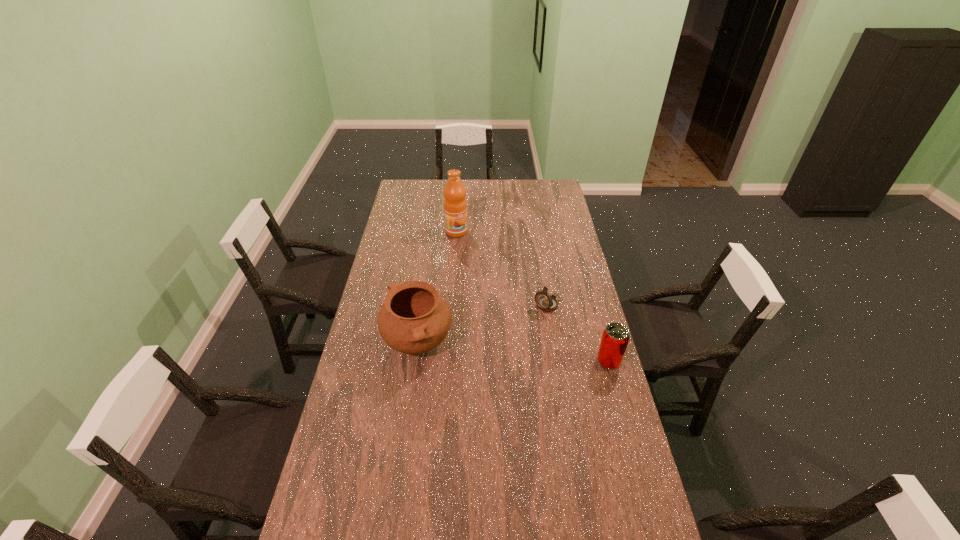
At what (x,y) coordinates should I click in order to perform the action: click on free space on the desktop that is between the pottery and the second shortest object and is positioned on the label side of the fruit juice. Please return your answer as a coordinate pair (x, y). Looking at the image, I should click on (539, 355).

At what (x,y) coordinates should I click in order to perform the action: click on free space on the desktop that is between the third shortest object and the rightmost object and is positioned on the face of the compass. Please return your answer as a coordinate pair (x, y). Looking at the image, I should click on (498, 351).